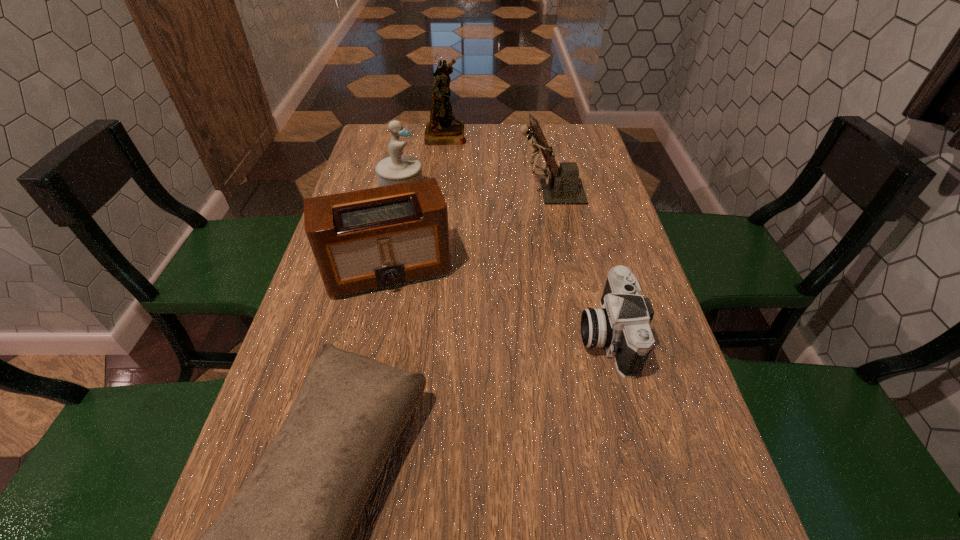
You are a GUI agent. You are given a task and a screenshot of the screen. Output one action in this format:
    pyautogui.click(x=<x>, y=<y>)
    Task: Click on the free space between the radio receiver and the camera
    The image size is (960, 540).
    Given the screenshot: What is the action you would take?
    pyautogui.click(x=497, y=302)

Find the location of a particular element. The width and height of the screenshot is (960, 540). free space between the rightmost figurine and the camera is located at coordinates (579, 263).

The width and height of the screenshot is (960, 540). Find the location of `the closest object relative to the farthest figurine`. the closest object relative to the farthest figurine is located at coordinates (398, 168).

You are a GUI agent. You are given a task and a screenshot of the screen. Output one action in this format:
    pyautogui.click(x=<x>, y=<y>)
    Task: Click on the object that ranks as the closest to the cushion
    The width and height of the screenshot is (960, 540).
    Given the screenshot: What is the action you would take?
    pyautogui.click(x=367, y=240)

Locate an element on the screen. figurine identified as the third closest to the camera is located at coordinates (443, 129).

Find the location of a particular element. This screenshot has height=540, width=960. figurine that stands as the second closest to the farthest figurine is located at coordinates (564, 187).

What are the coordinates of `free space that satisfies the following two spatial constraints: 1. on the front-facing side of the farthest figurine; 2. on the front side of the radio receiver` in the screenshot? It's located at (430, 270).

Identify the location of free region that satisfies the following two spatial constraints: 1. on the front-facing side of the rightmost figurine; 2. on the left side of the camera. The width and height of the screenshot is (960, 540). (578, 334).

Identify the location of free space that satisfies the following two spatial constraints: 1. on the front-facing side of the rightmost figurine; 2. on the right side of the camera. (578, 334).

Where is `blank space that satisfies the following two spatial constraints: 1. on the front-facing side of the farthest figurine; 2. on the right side of the camera`? blank space that satisfies the following two spatial constraints: 1. on the front-facing side of the farthest figurine; 2. on the right side of the camera is located at coordinates (422, 334).